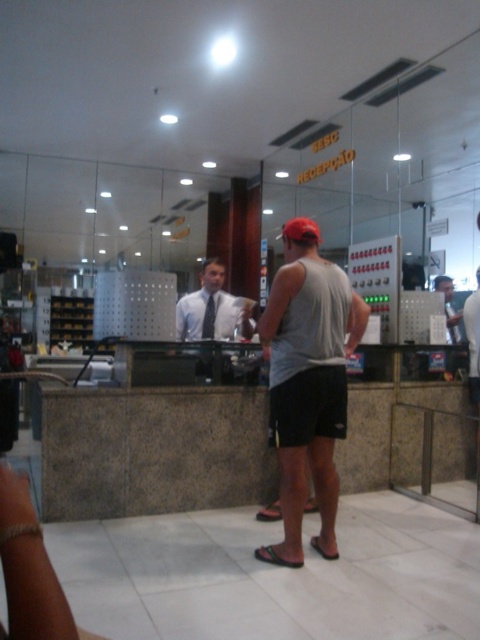
Question: Which point is closer to the camera?

Choices:
 (A) gray fabric tank top at center
 (B) gray matte tank top at center

Answer: (B)

Question: Where is gray fabric tank top at center located in relation to matte gray shirt at center in the image?

Choices:
 (A) below
 (B) above

Answer: (A)

Question: From the image, what is the correct spatial relationship of gray matte tank top at center in relation to matte white shirt at center?

Choices:
 (A) above
 (B) below

Answer: (B)

Question: Estimate the real-world distances between objects in this image. Which object is farther from the matte white shirt at center?

Choices:
 (A) gray matte tank top at center
 (B) gray fabric tank top at center

Answer: (B)

Question: Estimate the real-world distances between objects in this image. Which object is farther from the matte gray shirt at center?

Choices:
 (A) gray matte tank top at center
 (B) matte white shirt at center

Answer: (A)

Question: Does gray matte tank top at center appear on the left side of matte gray shirt at center?

Choices:
 (A) no
 (B) yes

Answer: (B)